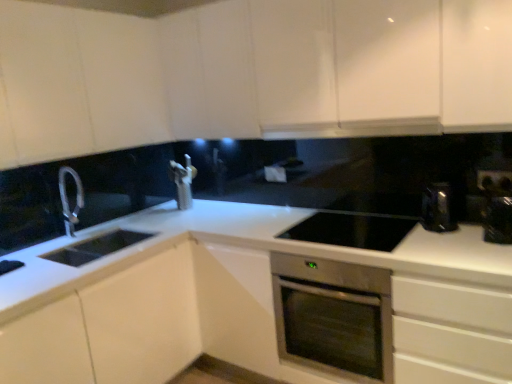
Question: Considering the positions of white glossy countertop at center and white glossy exhaust hood at upper center in the image, is white glossy countertop at center taller or shorter than white glossy exhaust hood at upper center?

Choices:
 (A) tall
 (B) short

Answer: (A)

Question: Is point (47, 248) positioned closer to the camera than point (372, 122)?

Choices:
 (A) farther
 (B) closer

Answer: (A)

Question: Which object is the farthest from the white glossy cabinet at upper left, the 2th cabinetry in the top-to-bottom sequence?

Choices:
 (A) black glass cooktop at center, positioned as the 1th appliance in left-to-right order
 (B) metallic silver toaster at right, the second appliance viewed from the left
 (C) white glossy countertop at center
 (D) stainless steel oven at center
 (E) white glossy cabinet at upper center, which is the third cabinetry from bottom to top

Answer: (B)

Question: Estimate the real-world distances between objects in this image. Which object is farther from the black plastic electric outlet at upper right?

Choices:
 (A) white glossy countertop at center
 (B) stainless steel oven at center
 (C) white glossy cabinet at upper left, arranged as the second cabinetry when ordered from the bottom
 (D) white glossy exhaust hood at upper center
 (E) black glass cooktop at center, positioned as the 1th appliance in left-to-right order

Answer: (C)